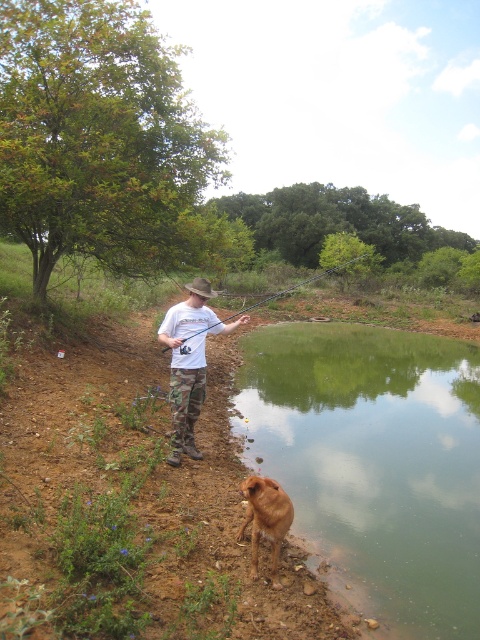
Question: Does white matte shirt at center appear over black rod at center?

Choices:
 (A) yes
 (B) no

Answer: (B)

Question: Which object is the closest to the white matte shirt at center?

Choices:
 (A) brown woven cowboy hat at center
 (B) green smooth water at lower center

Answer: (A)

Question: Can you confirm if brown furry dog at lower center is bigger than black rod at center?

Choices:
 (A) yes
 (B) no

Answer: (B)

Question: Does white matte shirt at center appear under brown furry dog at lower center?

Choices:
 (A) yes
 (B) no

Answer: (B)

Question: Which of the following is the closest to the observer?

Choices:
 (A) (280, 524)
 (B) (192, 458)
 (C) (350, 538)

Answer: (A)

Question: Which point appears farthest from the camera in this image?

Choices:
 (A) (192, 442)
 (B) (382, 396)

Answer: (B)